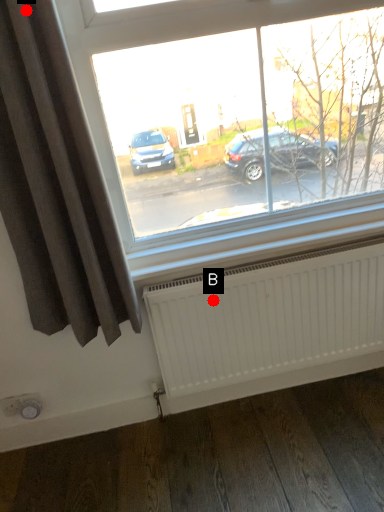
Question: Two points are circled on the image, labeled by A and B beside each circle. Which point is closer to the camera?

Choices:
 (A) A is closer
 (B) B is closer

Answer: (A)